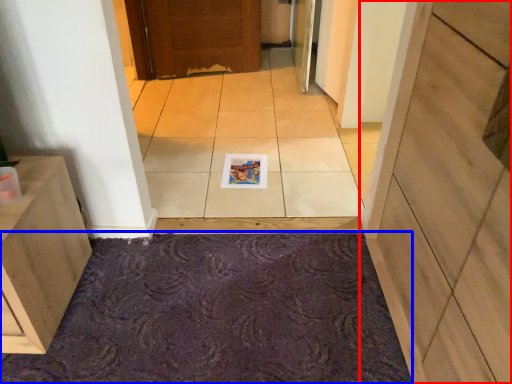
Question: Which object is closer to the camera taking this photo, door (highlighted by a red box) or bath mat (highlighted by a blue box)?

Choices:
 (A) door
 (B) bath mat

Answer: (A)